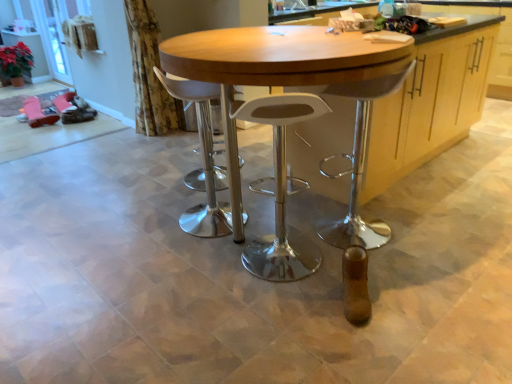
What do you see at coordinates (203, 161) in the screenshot? The image size is (512, 384). I see `white plastic stool at center, marked as the 1th stool in a left-to-right arrangement` at bounding box center [203, 161].

Find the location of a particular element. The image size is (512, 384). floral fabric curtain at upper left is located at coordinates pos(149,74).

Measure the distance between floral fabric curtain at upper left and camera.

floral fabric curtain at upper left and camera are 10.71 feet apart from each other.

Image resolution: width=512 pixels, height=384 pixels. Describe the element at coordinates (278, 70) in the screenshot. I see `wooden table at center` at that location.

What do you see at coordinates (281, 191) in the screenshot? This screenshot has height=384, width=512. I see `white plastic stool at center, the second stool from the left` at bounding box center [281, 191].

Locate an element on the screen. This screenshot has width=512, height=384. clear glass screen door at upper left is located at coordinates (56, 31).

Between white plastic stool at center, the 1th stool from the right, and white plastic stool at center, arranged as the second stool when viewed from the right, which one is positioned in front?

white plastic stool at center, the 1th stool from the right, is in front.

Where is `stool on the right of white plastic stool at center, marked as the 1th stool in a left-to-right arrangement`? stool on the right of white plastic stool at center, marked as the 1th stool in a left-to-right arrangement is located at coordinates (281, 191).

From the image's perspective, is white plastic stool at center, the second stool from the left, located beneath white plastic stool at center, marked as the 1th stool in a left-to-right arrangement?

Yes, from the image's perspective, white plastic stool at center, the second stool from the left, is beneath white plastic stool at center, marked as the 1th stool in a left-to-right arrangement.

Can you confirm if white plastic stool at center, the 1th stool from the right, is wider than white plastic stool at center, marked as the 1th stool in a left-to-right arrangement?

No, white plastic stool at center, the 1th stool from the right, is not wider than white plastic stool at center, marked as the 1th stool in a left-to-right arrangement.

Is point (479, 36) closer or farther from the camera than point (212, 182)?

Point (479, 36).

Find the location of a particular element. This screenshot has height=384, width=512. cabinetry located above the white plastic stool at center, marked as the 1th stool in a left-to-right arrangement (from a real-world perspective) is located at coordinates (431, 102).

Who is taller, wooden cabinet at center or white plastic stool at center, marked as the 1th stool in a left-to-right arrangement?

Standing taller between the two is wooden cabinet at center.

From a real-world perspective, which is physically below, wooden cabinet at center or white plastic stool at center, marked as the 1th stool in a left-to-right arrangement?

In real-world perspective, white plastic stool at center, marked as the 1th stool in a left-to-right arrangement, is lower.

From the image's perspective, which is above, wooden table at center or white plastic stool at center, the second stool from the left?

wooden table at center, from the image's perspective.

Is white plastic stool at center, the second stool from the left, located within wooden table at center?

Yes, wooden table at center is surrounding white plastic stool at center, the second stool from the left.

Is wooden table at center turned away from white plastic stool at center, the second stool from the left?

wooden table at center is not turned away from white plastic stool at center, the second stool from the left.

Consider the image. Is wooden table at center touching white plastic stool at center, the second stool from the left?

wooden table at center and white plastic stool at center, the second stool from the left, are not in contact.

You are a GUI agent. You are given a task and a screenshot of the screen. Output one action in this format:
    pyautogui.click(x=<x>, y=<y>)
    Task: Click on the screen door positioned vertically above the wooden table at center (from a real-world perspective)
    
    Given the screenshot: What is the action you would take?
    pyautogui.click(x=56, y=31)

From a real-world perspective, who is located higher, clear glass screen door at upper left or wooden table at center?

clear glass screen door at upper left is physically above.

Does clear glass screen door at upper left have a lesser width compared to wooden table at center?

Yes, clear glass screen door at upper left is thinner than wooden table at center.

Is point (49, 10) positioned after point (225, 132)?

Yes, point (49, 10) is behind point (225, 132).

Is wooden table at center taller or shorter than wooden cabinet at center?

Clearly, wooden table at center is taller compared to wooden cabinet at center.

Measure the distance between wooden table at center and wooden cabinet at center.

wooden table at center is 24.23 inches away from wooden cabinet at center.

Locate an element on the screen. The height and width of the screenshot is (384, 512). table in front of the wooden cabinet at center is located at coordinates (278, 70).

Between wooden table at center and wooden cabinet at center, which one has smaller size?

Smaller between the two is wooden cabinet at center.

From the image's perspective, between white plastic stool at center, arranged as the second stool when viewed from the right, and white plastic stool at center, the 1th stool from the right, which one is located above?

white plastic stool at center, arranged as the second stool when viewed from the right, from the image's perspective.

Looking at the image, does white plastic stool at center, marked as the 1th stool in a left-to-right arrangement, seem bigger or smaller compared to white plastic stool at center, the 1th stool from the right?

white plastic stool at center, marked as the 1th stool in a left-to-right arrangement, is bigger than white plastic stool at center, the 1th stool from the right.

Do you think white plastic stool at center, marked as the 1th stool in a left-to-right arrangement, is within white plastic stool at center, the 1th stool from the right, or outside of it?

The correct answer is: outside.

Is white plastic stool at center, arranged as the second stool when viewed from the right, far away from white plastic stool at center, the 1th stool from the right?

white plastic stool at center, arranged as the second stool when viewed from the right, is actually quite close to white plastic stool at center, the 1th stool from the right.

This screenshot has height=384, width=512. Find the location of `curtain in front of the clear glass screen door at upper left`. curtain in front of the clear glass screen door at upper left is located at coordinates (149, 74).

Which is behind, floral fabric curtain at upper left or clear glass screen door at upper left?

clear glass screen door at upper left is behind.

Looking at their sizes, would you say floral fabric curtain at upper left is wider or thinner than clear glass screen door at upper left?

Considering their sizes, floral fabric curtain at upper left looks broader than clear glass screen door at upper left.

Is floral fabric curtain at upper left with clear glass screen door at upper left?

No, floral fabric curtain at upper left is not next to clear glass screen door at upper left.

What are the coordinates of `stool on the right of the white plastic stool at center, marked as the 1th stool in a left-to-right arrangement` in the screenshot? It's located at (281, 191).

Where is `stool that is the 1st one when counting downward from the wooden cabinet at center (from the image's perspective)`? This screenshot has height=384, width=512. stool that is the 1st one when counting downward from the wooden cabinet at center (from the image's perspective) is located at coordinates (203, 161).

Looking at the image, which one is located further to white plastic stool at center, the second stool from the left, white plastic stool at center, marked as the 1th stool in a left-to-right arrangement, or floral fabric curtain at upper left?

The object further to white plastic stool at center, the second stool from the left, is floral fabric curtain at upper left.

Considering their positions, is clear glass screen door at upper left positioned further to white plastic stool at center, arranged as the second stool when viewed from the right, than wooden cabinet at center?

Among the two, clear glass screen door at upper left is located further to white plastic stool at center, arranged as the second stool when viewed from the right.

From the image, which object appears to be nearer to wooden table at center, floral fabric curtain at upper left or clear glass screen door at upper left?

Among the two, floral fabric curtain at upper left is located nearer to wooden table at center.

Looking at this image, from the image, which object appears to be farther from clear glass screen door at upper left, wooden cabinet at center or floral fabric curtain at upper left?

wooden cabinet at center.

Looking at the image, which one is located closer to floral fabric curtain at upper left, white plastic stool at center, the second stool from the left, or clear glass screen door at upper left?

The object closer to floral fabric curtain at upper left is white plastic stool at center, the second stool from the left.

Estimate the real-world distances between objects in this image. Which object is further from clear glass screen door at upper left, floral fabric curtain at upper left or white plastic stool at center, the 1th stool from the right?

white plastic stool at center, the 1th stool from the right, lies further to clear glass screen door at upper left than the other object.

Looking at this image, looking at the image, which one is located closer to wooden table at center, white plastic stool at center, arranged as the second stool when viewed from the right, or white plastic stool at center, the 1th stool from the right?

The object closer to wooden table at center is white plastic stool at center, the 1th stool from the right.

From the image, which object appears to be farther from wooden table at center, clear glass screen door at upper left or white plastic stool at center, marked as the 1th stool in a left-to-right arrangement?

Among the two, clear glass screen door at upper left is located further to wooden table at center.

I want to click on table between white plastic stool at center, arranged as the second stool when viewed from the right, and wooden cabinet at center, in the horizontal direction, so click(x=278, y=70).

You are a GUI agent. You are given a task and a screenshot of the screen. Output one action in this format:
    pyautogui.click(x=<x>, y=<y>)
    Task: Click on the curtain between white plastic stool at center, the 1th stool from the right, and clear glass screen door at upper left from front to back
    The width and height of the screenshot is (512, 384).
    Given the screenshot: What is the action you would take?
    pyautogui.click(x=149, y=74)

Identify the location of curtain between clear glass screen door at upper left and wooden cabinet at center from left to right. The height and width of the screenshot is (384, 512). (149, 74).

Where is `curtain between wooden table at center and clear glass screen door at upper left in the front-back direction`? The height and width of the screenshot is (384, 512). curtain between wooden table at center and clear glass screen door at upper left in the front-back direction is located at coordinates (149, 74).